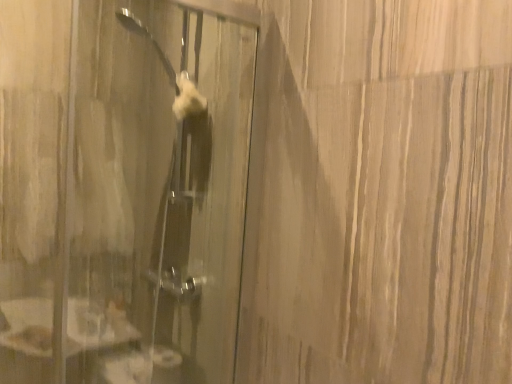
Locate an element on the screen. The image size is (512, 384). transparent glass door at center is located at coordinates (128, 200).

In order to face transparent glass door at center, should I rotate leftwards or rightwards?

It's best to rotate left around 13.999 degrees.

The height and width of the screenshot is (384, 512). What do you see at coordinates (128, 200) in the screenshot? I see `transparent glass door at center` at bounding box center [128, 200].

Locate an element on the screen. transparent glass door at center is located at coordinates (128, 200).